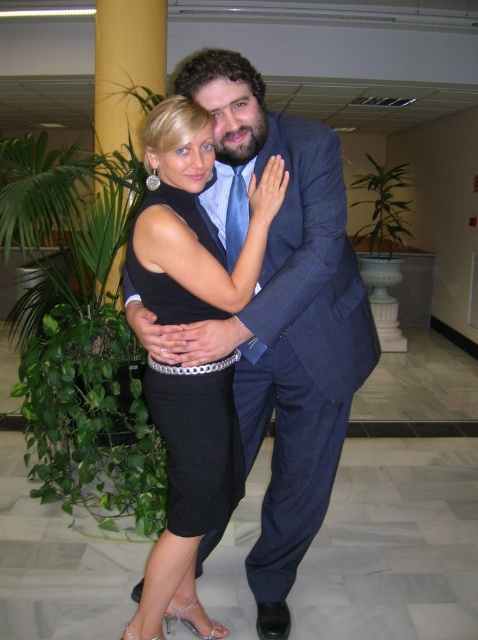
Question: Can you confirm if satin black dress at center is positioned to the left of black satin dress at center?

Choices:
 (A) no
 (B) yes

Answer: (A)

Question: Which point appears farthest from the camera in this image?

Choices:
 (A) (216, 280)
 (B) (185, 524)

Answer: (B)

Question: Is satin black dress at center positioned before black satin dress at center?

Choices:
 (A) yes
 (B) no

Answer: (A)

Question: Which point is farther to the camera?

Choices:
 (A) black satin dress at center
 (B) satin black dress at center

Answer: (A)

Question: In this image, where is satin black dress at center located relative to black satin dress at center?

Choices:
 (A) above
 (B) below

Answer: (B)